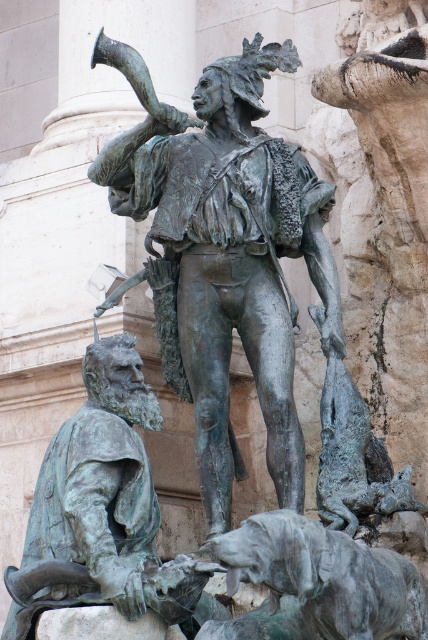
You are an art student analyzing the composition of the bronze statue at center and the greenish patina dog at lower center. Based on their positions, which one is placed higher in the image?

The bronze statue at center is located above the greenish patina dog at lower center, so it is placed higher in the image.

Looking at the bronze statue at center and the greenish patina dog at lower center in the image, which object takes up more space?

The bronze statue at center is larger in size than the greenish patina dog at lower center, so it takes up more space.

Based on the photo, you are standing at the camera position looking at the bronze statue. There is a point at coordinates point (240,262) that you want to reach. Can you estimate how far it is from your current position to that point?

The distance between point (240,262) and the camera is 75.77 meters.